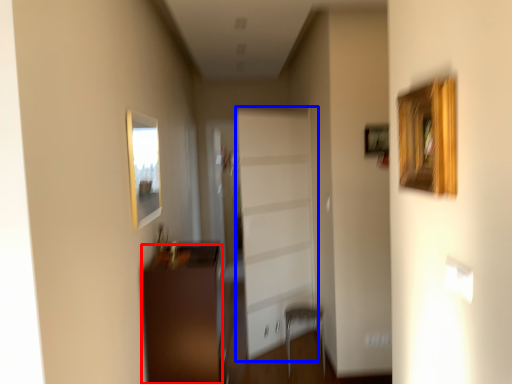
Question: Among these objects, which one is farthest to the camera, furniture (highlighted by a red box) or garage door (highlighted by a blue box)?

Choices:
 (A) furniture
 (B) garage door

Answer: (B)